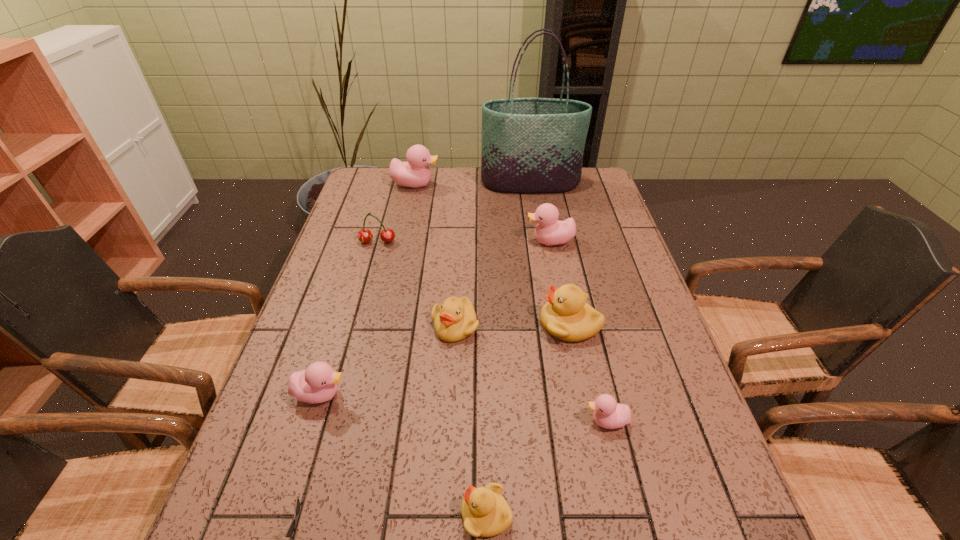
Where is `duckling that is the fourth nearest to the rightmost yellow duckling`? The height and width of the screenshot is (540, 960). duckling that is the fourth nearest to the rightmost yellow duckling is located at coordinates (485, 512).

Locate which duckling is the closest to the biggest yellow duckling. Please provide its 2D coordinates. Your answer should be formatted as a tuple, i.e. [(x, y)], where the tuple contains the x and y coordinates of a point satisfying the conditions above.

[(455, 319)]

Identify which pink duckling is located as the nearest to the red cherry. Please provide its 2D coordinates. Your answer should be formatted as a tuple, i.e. [(x, y)], where the tuple contains the x and y coordinates of a point satisfying the conditions above.

[(415, 173)]

Identify the location of pink duckling identified as the second closest to the cherry. The height and width of the screenshot is (540, 960). (549, 231).

Locate which yellow duckling is the second closest to the second smallest yellow duckling. Please provide its 2D coordinates. Your answer should be formatted as a tuple, i.e. [(x, y)], where the tuple contains the x and y coordinates of a point satisfying the conditions above.

[(485, 512)]

Locate an element on the screen. The width and height of the screenshot is (960, 540). yellow duckling that is the closest one to the biggest yellow duckling is located at coordinates (455, 319).